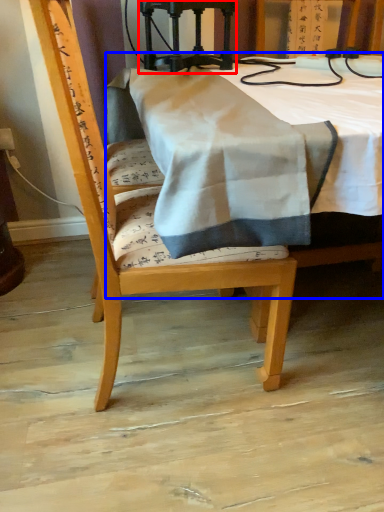
Question: Which object is further to the camera taking this photo, equipment (highlighted by a red box) or table (highlighted by a blue box)?

Choices:
 (A) equipment
 (B) table

Answer: (A)